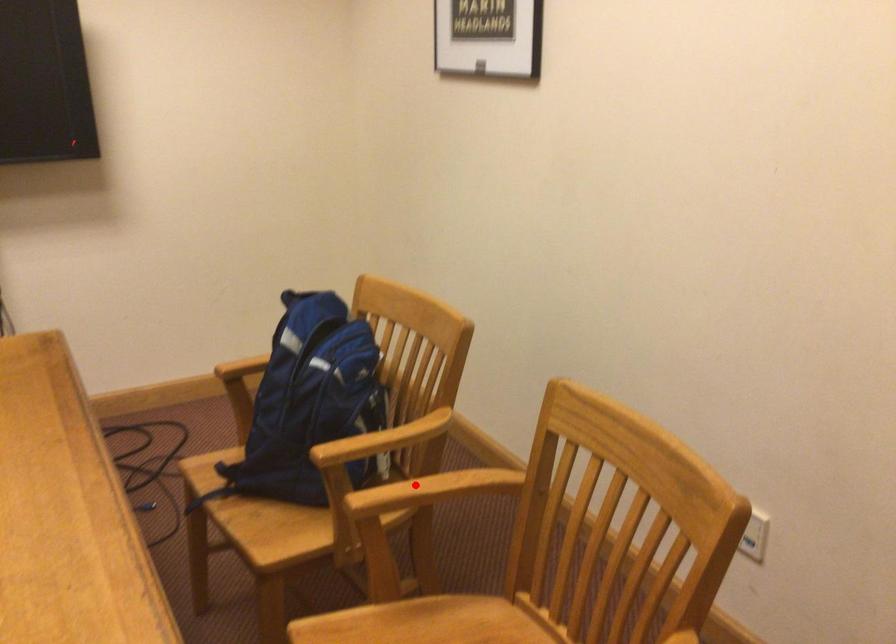
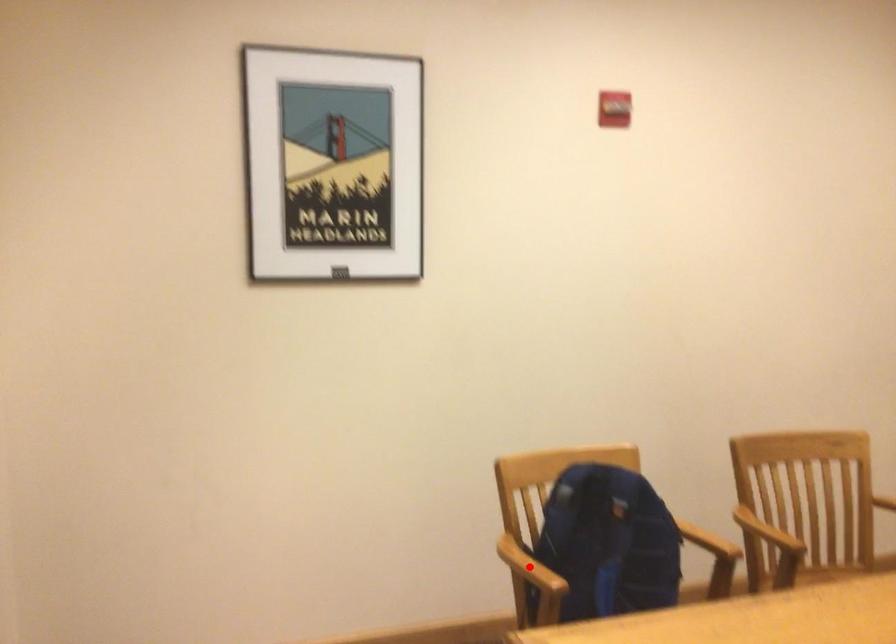
I am providing you with two images of the same scene from different viewpoints. A red point is marked on the first image and another point is marked on the second image. Do the highlighted points in image1 and image2 indicate the same real-world spot?

No